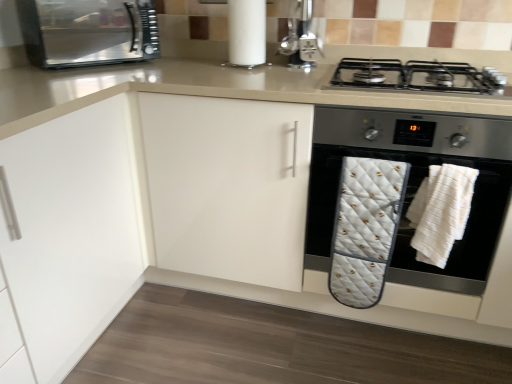
Question: Is white quilted oven mitt at lower right wider or thinner than white textured bath towel at lower right, which is counted as the first bath towel, starting from the right?

Choices:
 (A) wide
 (B) thin

Answer: (A)

Question: Choose the correct answer: Is white quilted oven mitt at lower right inside white textured bath towel at lower right, the 2th bath towel from the left, or outside it?

Choices:
 (A) outside
 (B) inside

Answer: (A)

Question: Which object is positioned farthest from the black matte gas stove at upper right?

Choices:
 (A) metallic stainless steel microwave at upper left
 (B) white matte paper towel at upper center
 (C) white quilted oven mitt at center, which is the first bath towel from left to right
 (D) white textured bath towel at lower right, the 2th bath towel from the left
 (E) metallic silver coffee machine at upper center

Answer: (A)

Question: Estimate the real-world distances between objects in this image. Which object is farther from the metallic silver coffee machine at upper center?

Choices:
 (A) metallic stainless steel microwave at upper left
 (B) black matte gas stove at upper right
 (C) white quilted oven mitt at center, which ranks as the second bath towel in right-to-left order
 (D) white matte paper towel at upper center
 (E) white quilted oven mitt at lower right

Answer: (A)